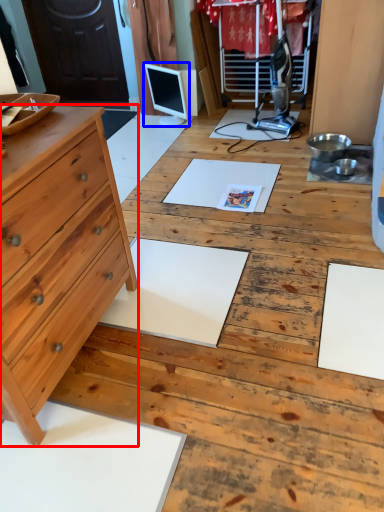
Question: Which of the following is the closest to the observer, chest of drawers (highlighted by a red box) or computer monitor (highlighted by a blue box)?

Choices:
 (A) chest of drawers
 (B) computer monitor

Answer: (A)